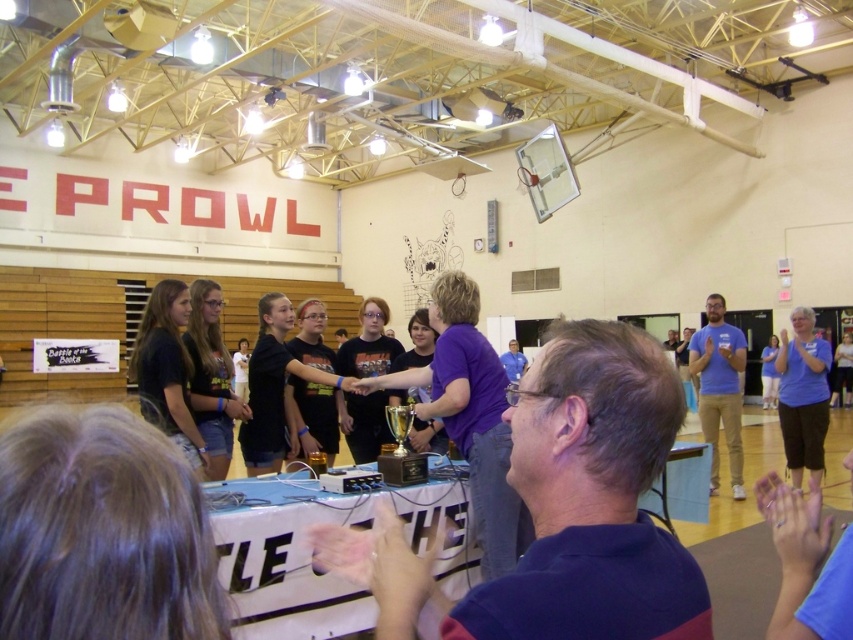
Question: Is blue fabric shirt at right to the right of blue cotton shirt at right from the viewer's perspective?

Choices:
 (A) no
 (B) yes

Answer: (B)

Question: Is blue fabric shirt at right positioned at the back of blue cotton shirt at right?

Choices:
 (A) yes
 (B) no

Answer: (B)

Question: Among these objects, which one is farthest from the camera?

Choices:
 (A) blue fabric shirt at right
 (B) blue cotton shirt at right

Answer: (B)

Question: Is blue fabric shirt at right below blue cotton shirt at right?

Choices:
 (A) yes
 (B) no

Answer: (B)